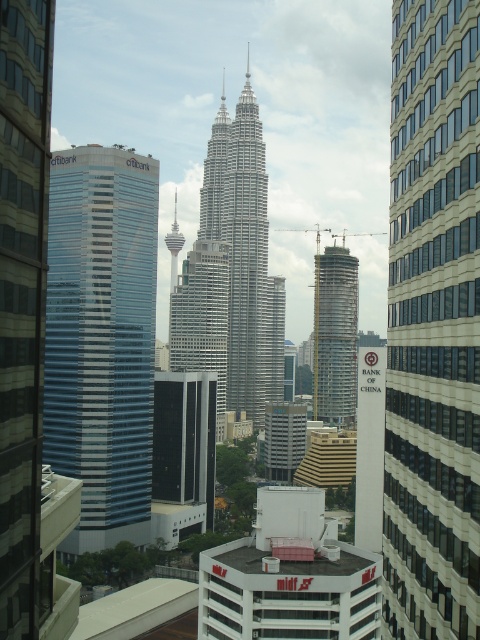
Consider the image. Measure the distance between white glass building at center and blue glass skyscraper at left.

white glass building at center and blue glass skyscraper at left are 91.02 meters apart from each other.

Between white glass building at center and blue glass skyscraper at left, which one has more height?

Standing taller between the two is blue glass skyscraper at left.

Image resolution: width=480 pixels, height=640 pixels. I want to click on white glass building at center, so click(432, 324).

Is point (197, 442) in front of point (219, 330)?

Yes, it is in front of point (219, 330).

Which is below, black glass building at center or glassy silver skyscraper at center?

black glass building at center

Which is behind, point (202, 493) or point (194, 314)?

The point (194, 314) is behind.

The height and width of the screenshot is (640, 480). Find the location of `black glass building at center`. black glass building at center is located at coordinates (182, 452).

In the scene shown: Who is more distant from viewer, (395, 602) or (210, 456)?

The point (210, 456) is more distant.

The width and height of the screenshot is (480, 640). Identify the location of white glass building at center. (432, 324).